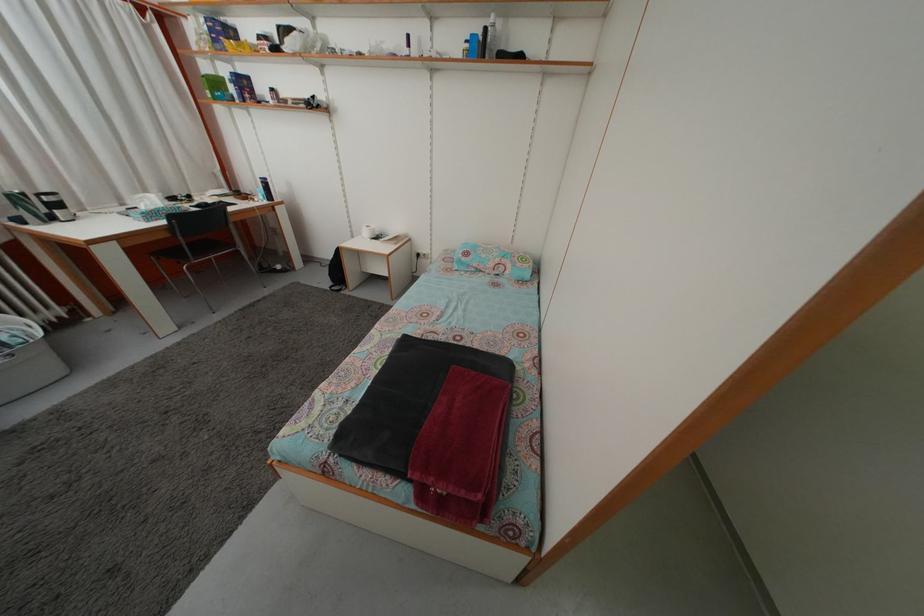
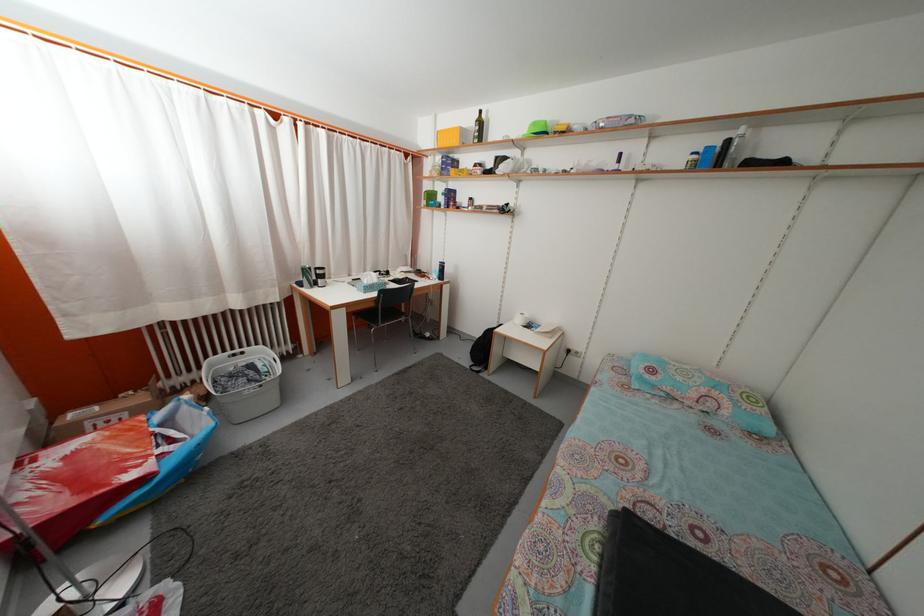
Question: The camera is either moving clockwise (left) or counter-clockwise (right) around the object. The first image is from the beginning of the video and the second image is from the end. Is the camera moving left or right when shooting the video?

Choices:
 (A) Left
 (B) Right

Answer: (B)